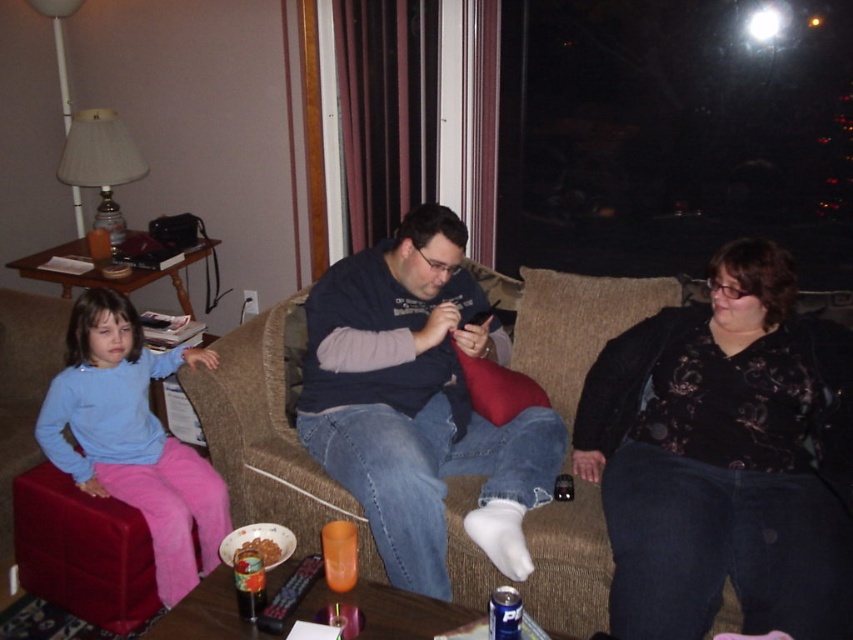
Question: Is black floral sweater at center positioned behind brown fabric couch at center?

Choices:
 (A) yes
 (B) no

Answer: (B)

Question: Which object is closer to the camera taking this photo?

Choices:
 (A) brown fabric couch at center
 (B) light blue fleece sweater at lower left
 (C) black floral sweater at center

Answer: (C)

Question: Which point is closer to the camera?

Choices:
 (A) brown fabric couch at center
 (B) dark blue sweater at center
 (C) light blue fleece sweater at lower left
 (D) black floral sweater at center

Answer: (D)

Question: Can you confirm if dark blue sweater at center is positioned to the right of light blue fleece sweater at lower left?

Choices:
 (A) no
 (B) yes

Answer: (B)

Question: Is black floral sweater at center wider than light blue fleece sweater at lower left?

Choices:
 (A) no
 (B) yes

Answer: (B)

Question: Which is farther from the dark blue sweater at center?

Choices:
 (A) brown fabric couch at center
 (B) light blue fleece sweater at lower left
 (C) shiny chocolate bar at lower center
 (D) black floral sweater at center

Answer: (C)